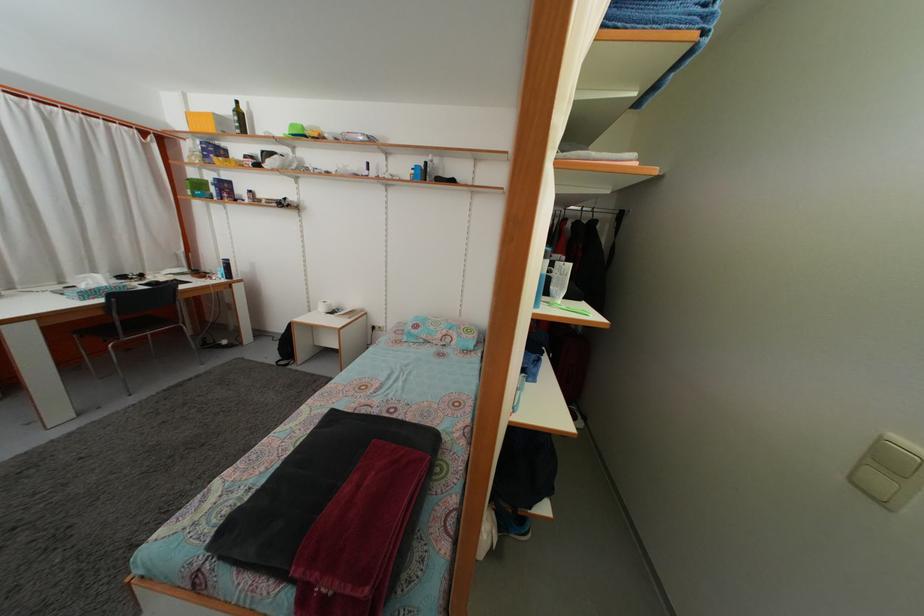
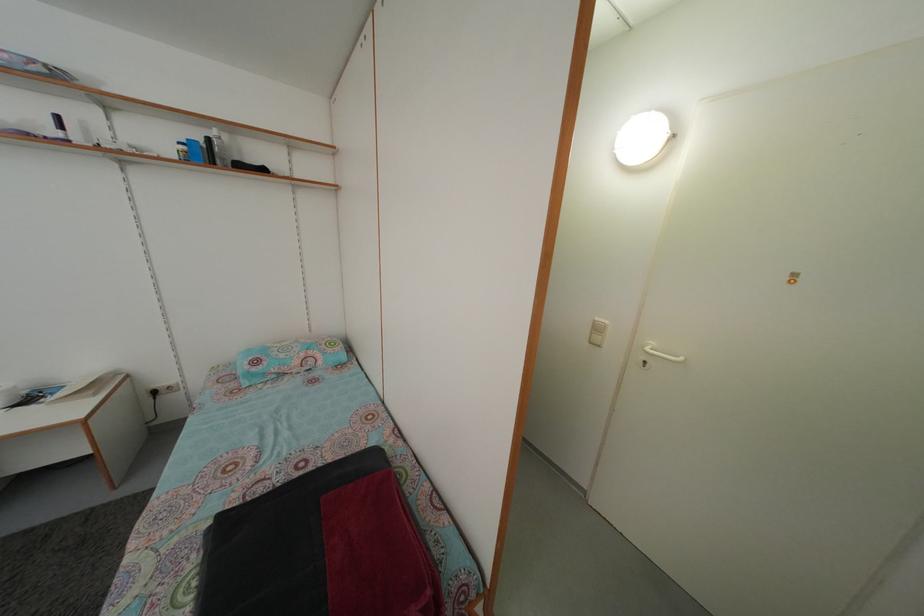
Question: The first image is from the beginning of the video and the second image is from the end. How did the camera likely rotate when shooting the video?

Choices:
 (A) Left
 (B) Right
 (C) Up
 (D) Down

Answer: (B)